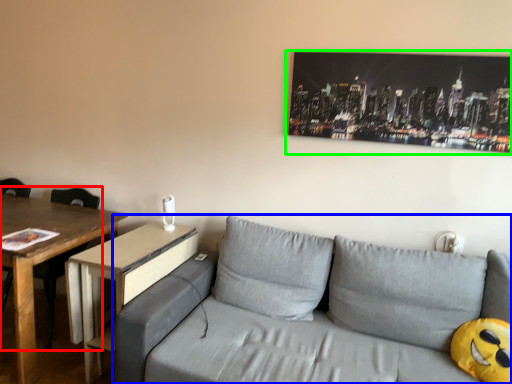
Question: Which is farther away from chair (highlighted by a red box)? studio couch (highlighted by a blue box) or picture frame (highlighted by a green box)?

Choices:
 (A) studio couch
 (B) picture frame

Answer: (B)